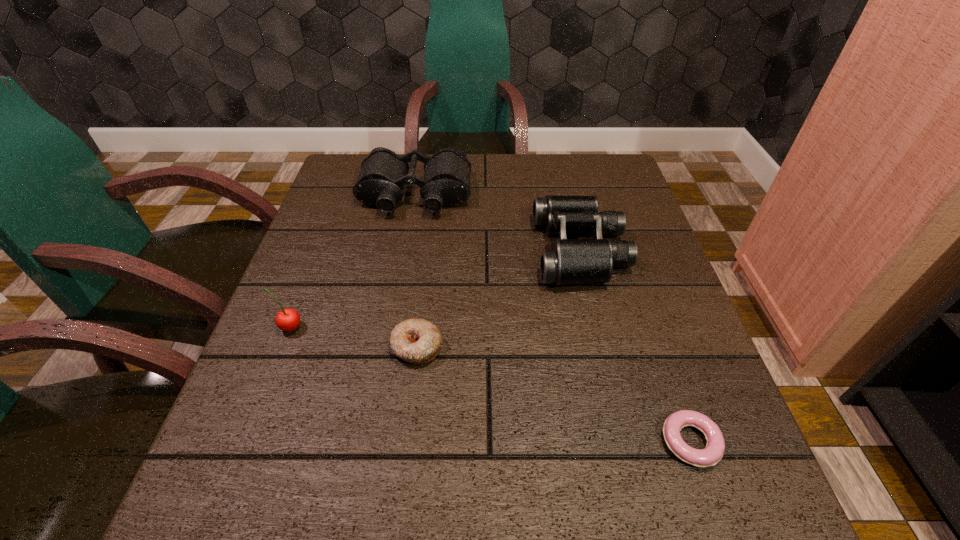
At what (x,y) coordinates should I click in order to perform the action: click on vacant area that satisfies the following two spatial constraints: 1. on the front side of the right doughnut; 2. on the left side of the taller doughnut. Please return your answer as a coordinate pair (x, y). Image resolution: width=960 pixels, height=540 pixels. Looking at the image, I should click on (405, 442).